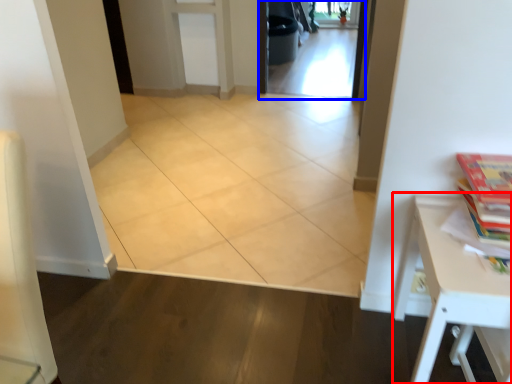
Question: Among these objects, which one is farthest to the camera, table (highlighted by a red box) or screen door (highlighted by a blue box)?

Choices:
 (A) table
 (B) screen door

Answer: (B)